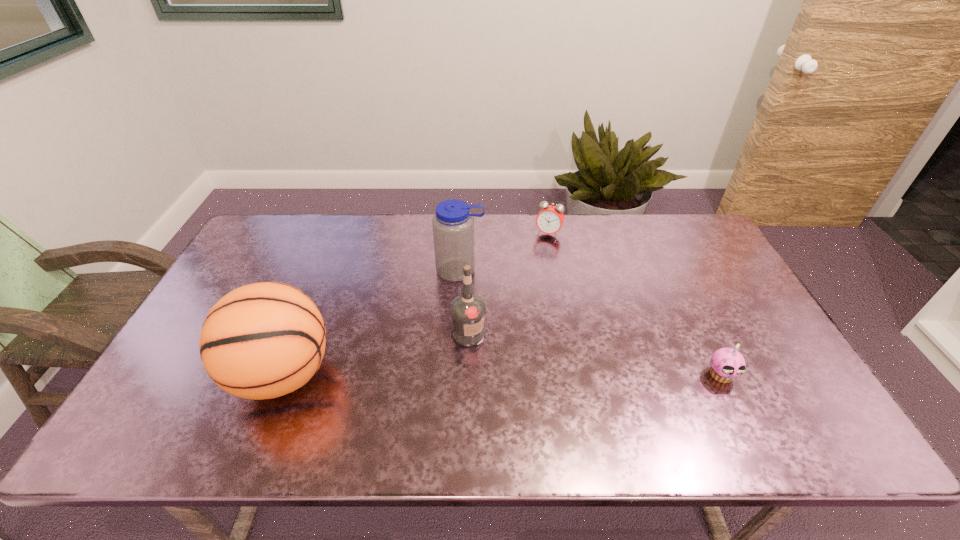
Identify the location of basketball. (264, 340).

Where is `cupcake`? Image resolution: width=960 pixels, height=540 pixels. cupcake is located at coordinates (727, 364).

This screenshot has height=540, width=960. Identify the location of vodka. (468, 310).

Where is `the farthest object`? the farthest object is located at coordinates (549, 220).

Where is `alarm clock`? alarm clock is located at coordinates (549, 220).

Find the location of a particular element. Image resolution: width=960 pixels, height=540 pixels. water bottle is located at coordinates (453, 225).

You are a GUI agent. You are given a task and a screenshot of the screen. Output one action in this format:
    pyautogui.click(x=<x>, y=<y>)
    Task: Click on the vacant space located 0.220m on the back of the basketball
    This screenshot has width=960, height=540.
    Given the screenshot: What is the action you would take?
    321,280

Locate an element on the screen. The height and width of the screenshot is (540, 960). vacant region located on the face of the cupcake is located at coordinates (735, 406).

Locate an element on the screen. The height and width of the screenshot is (540, 960). free space located 0.190m on the front label of the vodka is located at coordinates (544, 376).

Where is `vacant space situated on the front label of the vodka`? The image size is (960, 540). vacant space situated on the front label of the vodka is located at coordinates (538, 373).